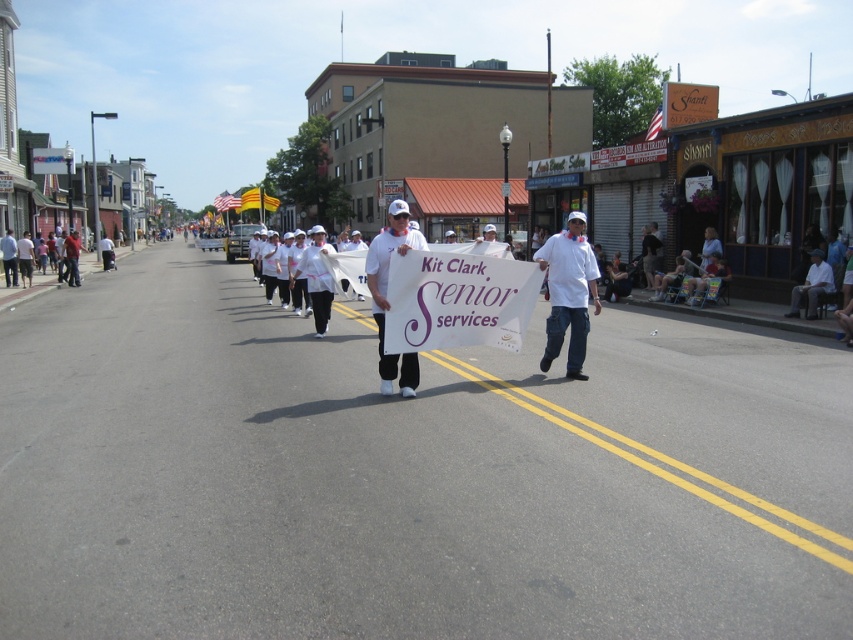
Question: Where is white matte sign at center located in relation to white fabric at center in the image?

Choices:
 (A) above
 (B) below

Answer: (B)

Question: Is white matte sign at center further to the viewer compared to white fabric uniform at center?

Choices:
 (A) yes
 (B) no

Answer: (B)

Question: Can you confirm if white chef hat at center is thinner than white fabric uniform at center?

Choices:
 (A) yes
 (B) no

Answer: (A)

Question: Which of the following is the closest to the observer?

Choices:
 (A) white chef hat at center
 (B) white fabric at center
 (C) white fabric uniform at center
 (D) white matte sign at center

Answer: (D)

Question: Which object appears farthest from the camera in this image?

Choices:
 (A) white fabric at center
 (B) white fabric at right
 (C) white chef hat at center
 (D) white fabric uniform at center

Answer: (A)

Question: Among these objects, which one is nearest to the camera?

Choices:
 (A) white fabric at right
 (B) white fabric at center
 (C) white fabric uniform at center

Answer: (C)